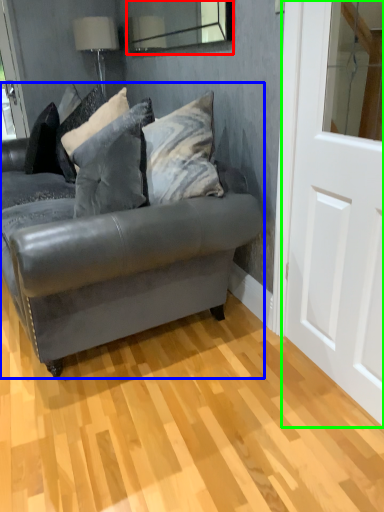
Question: Which is nearer to the mirror (highlighted by a red box)? studio couch (highlighted by a blue box) or screen door (highlighted by a green box).

Choices:
 (A) studio couch
 (B) screen door

Answer: (A)